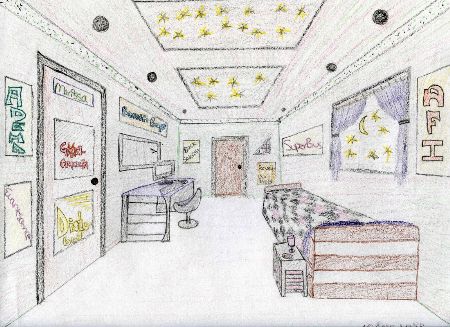
You are a GUI agent. You are given a task and a screenshot of the screen. Output one action in this format:
    pyautogui.click(x=<x>, y=<y>)
    Task: Click on the artwork
    Image resolution: width=450 pixels, height=327 pixels.
    Given the screenshot: What is the action you would take?
    pyautogui.click(x=317, y=312)